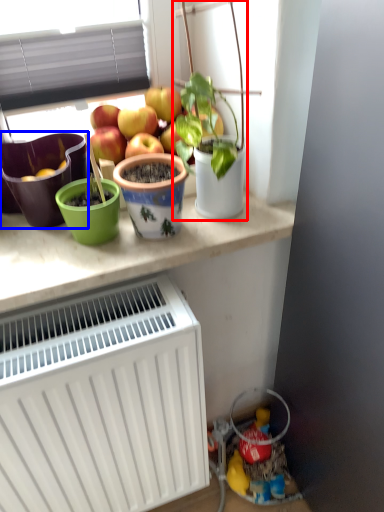
Question: Which object is further to the camera taking this photo, houseplant (highlighted by a red box) or flowerpot (highlighted by a blue box)?

Choices:
 (A) houseplant
 (B) flowerpot

Answer: (B)